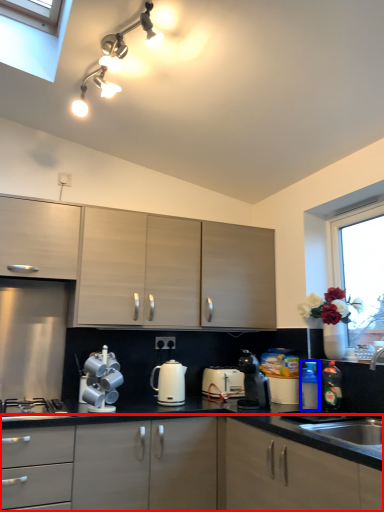
Question: Which object is further to the camera taking this photo, cabinetry (highlighted by a red box) or bottle (highlighted by a blue box)?

Choices:
 (A) cabinetry
 (B) bottle

Answer: (B)